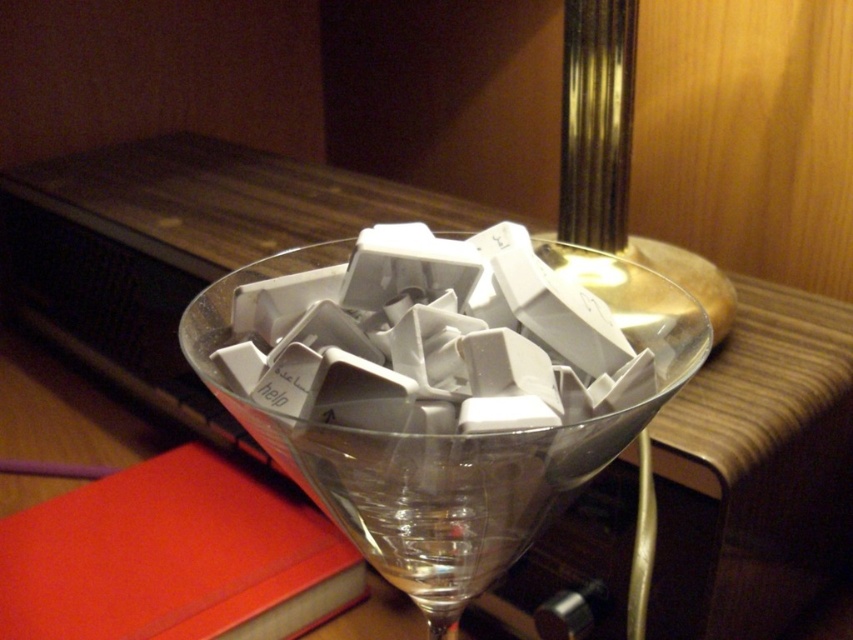
You are a delivery robot with a 12 inch wide package. You need to move from the red matte book at lower left to the transparent glass at center. Is there enough space to move the package between them?

The distance between the transparent glass at center and the red matte book at lower left is 11.51 inches. Since the package is 12 inches wide, it is slightly too wide to fit through the space between them. You may need to find an alternative path or adjust the package size.

You are a photographer adjusting your camera focus. You notice two points in the image at coordinates point (347, 506) and point (91, 563). Which point should you focus on first if you want to ensure the closest object is sharp?

Point (347, 506) is closer to the camera than point (91, 563), so you should focus on point (347, 506) first to ensure the closest object is sharp.

You are a bartender preparing a drink for a customer. You have a transparent glass at center and a red matte book at lower left on the counter. The customer asks if the book can fit inside the glass. Based on their sizes, what do you tell them?

The transparent glass at center is taller than the red matte book at lower left, so the book cannot fit inside the glass vertically. However, the book might fit horizontally if its width is smaller than the glass diameter, but the description only mentions height comparison.